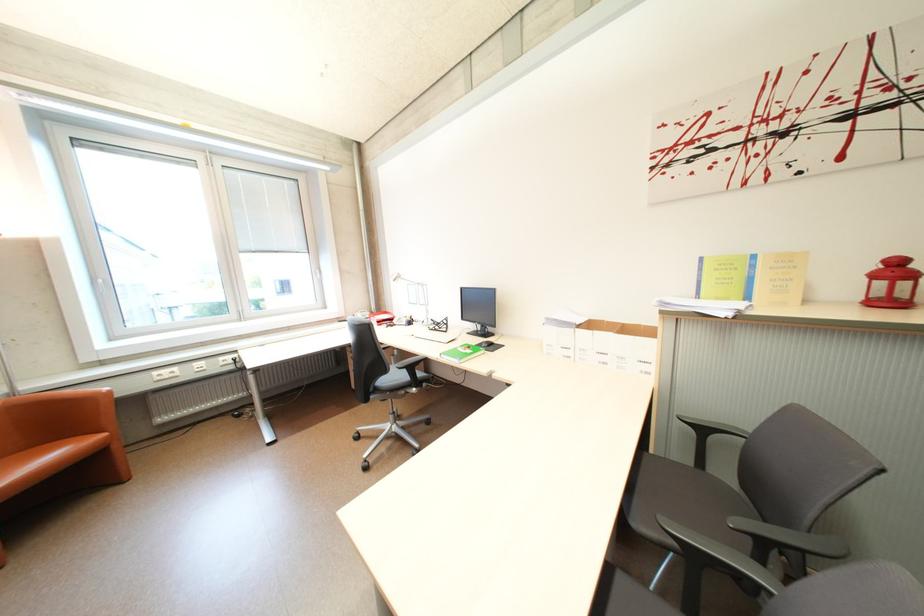
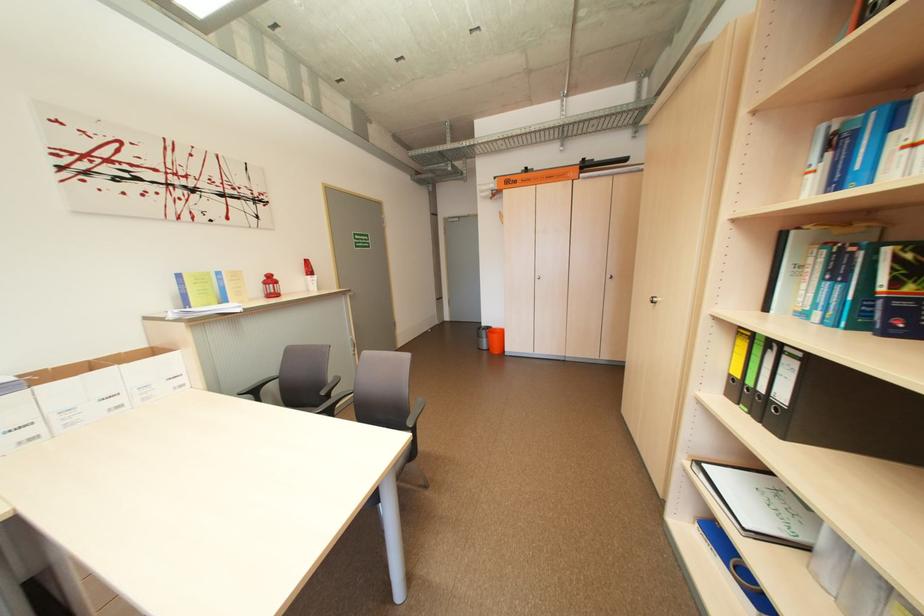
Find the pixel in the second image that matches (x=882, y=277) in the first image.

(274, 284)